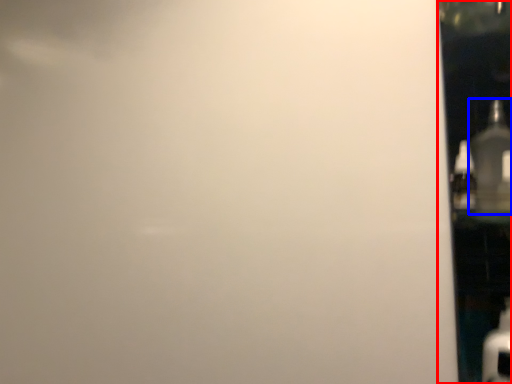
Question: Which object appears farthest to the camera in this image, glass door (highlighted by a red box) or bottle (highlighted by a blue box)?

Choices:
 (A) glass door
 (B) bottle

Answer: (B)